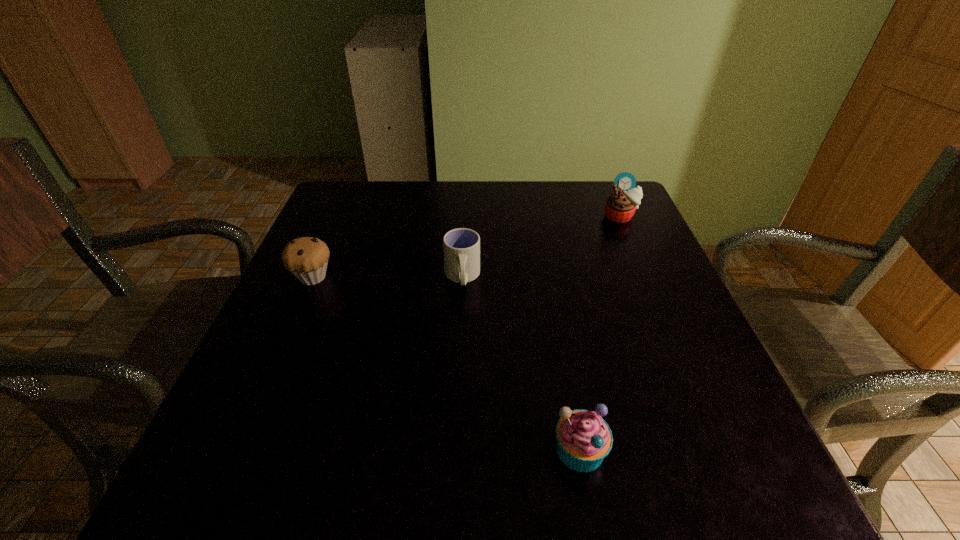
The width and height of the screenshot is (960, 540). Identify the location of the farthest object. (620, 206).

Locate an element on the screen. the rightmost object is located at coordinates pos(620,206).

You are a GUI agent. You are given a task and a screenshot of the screen. Output one action in this format:
    pyautogui.click(x=<x>, y=<y>)
    Task: Click on the cup
    This screenshot has width=960, height=540.
    Given the screenshot: What is the action you would take?
    pyautogui.click(x=461, y=246)

This screenshot has height=540, width=960. What are the coordinates of `the leftmost muffin` in the screenshot? It's located at (306, 258).

Find the location of a particular element. The image size is (960, 540). the second nearest muffin is located at coordinates (306, 258).

At what (x,y) coordinates should I click in order to perform the action: click on the third object from left to right. Please return your answer as a coordinate pair (x, y). The width and height of the screenshot is (960, 540). Looking at the image, I should click on (583, 438).

At what (x,y) coordinates should I click in order to perform the action: click on the nearest object. Please return your answer as a coordinate pair (x, y). This screenshot has height=540, width=960. Looking at the image, I should click on (583, 438).

Locate an element on the screen. vacant area located on the front-facing side of the rightmost muffin is located at coordinates (675, 342).

Locate an element on the screen. This screenshot has width=960, height=540. vacant space positioned 0.250m with the handle on the side of the second object from left to right is located at coordinates (457, 400).

Locate an element on the screen. Image resolution: width=960 pixels, height=540 pixels. free spot located 0.290m on the front of the leftmost object is located at coordinates (252, 416).